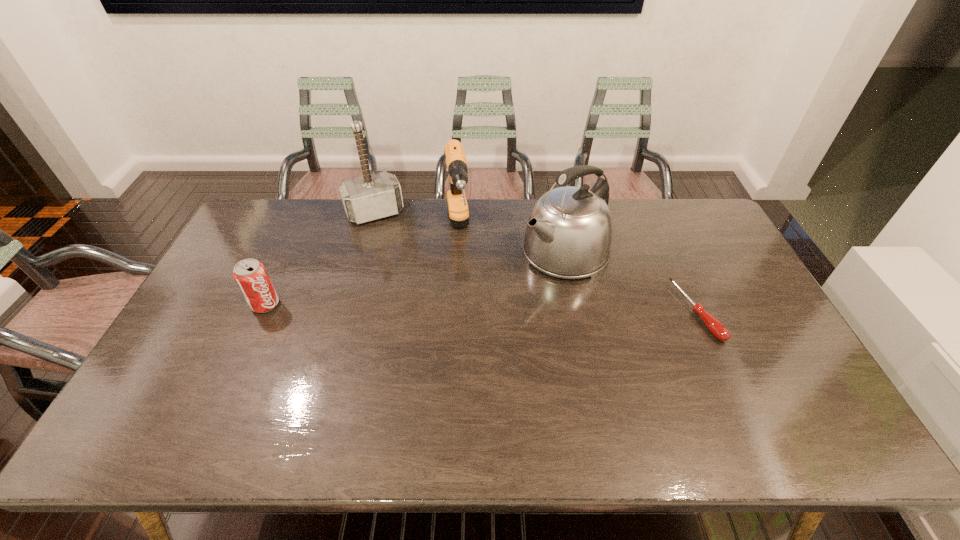
Find the location of a particular element. This screenshot has height=540, width=960. free space at the near right corner is located at coordinates 758,394.

I want to click on vacant area that lies between the second shortest object and the screwdriver, so pos(481,308).

You are a GUI agent. You are given a task and a screenshot of the screen. Output one action in this format:
    pyautogui.click(x=<x>, y=<y>)
    Task: Click on the free spot between the leftmost object and the second object from right to left
    This screenshot has height=540, width=960.
    Given the screenshot: What is the action you would take?
    pyautogui.click(x=415, y=278)

The image size is (960, 540). I want to click on empty location between the leftmost object and the rightmost object, so click(481, 308).

Locate an element on the screen. unoccupied area between the second shortest object and the drill is located at coordinates pyautogui.click(x=361, y=267).

At what (x,y) coordinates should I click in order to perform the action: click on empty space that is in between the soda can and the drill. Please return your answer as a coordinate pair (x, y). The width and height of the screenshot is (960, 540). Looking at the image, I should click on (361, 267).

The image size is (960, 540). I want to click on empty space that is in between the kettle and the third object from right to left, so click(x=511, y=241).

Where is `free space that is in between the third shortest object and the fourth object from left to right`? free space that is in between the third shortest object and the fourth object from left to right is located at coordinates (511, 241).

The image size is (960, 540). What are the coordinates of `vacant point located between the soda can and the fourth object from right to left` in the screenshot? It's located at (320, 259).

Identify which object is located as the nearest to the rightmost object. Please provide its 2D coordinates. Your answer should be formatted as a tuple, i.e. [(x, y)], where the tuple contains the x and y coordinates of a point satisfying the conditions above.

[(568, 235)]